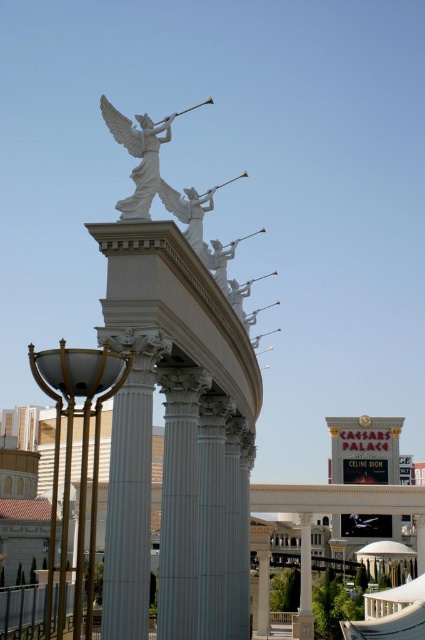
You are standing at the base of the grand structure and want to take a photo of the statue of the angelic figure atop the curved pediment. You have a camera with a zoom lens that can focus up to 20 meters. Is the gold polished metal lamp post at lower left in the frame when you take this photo?

The gold polished metal lamp post at lower left is 21.12 meters away from the camera. Since the camera can only focus up to 20 meters, the lamp post will not be in focus and thus not clearly visible in the frame.

You are standing at the entrance of Caesars Palace and want to take a photo of the white marble angel at upper center. To avoid blocking the statue, you need to position yourself so that the gold polished metal lamp post at lower left is not in the frame. Which direction should you move relative to the lamp post?

Move to the right of the gold polished metal lamp post at lower left so that it stays out of the frame while keeping the white marble angel at upper center in view.

You are a visitor at Caesars Palace and want to take a photo of the gold polished metal lamp post at lower left and the white marble angel at upper center in the background. Will the lamp post block the view of the angel in the photo?

The gold polished metal lamp post at lower left is much taller than the white marble angel at upper center, so it will block the view of the angel in the photo.